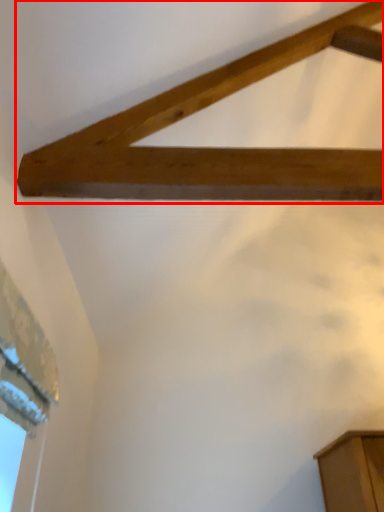
Question: Observing the image, what is the correct spatial positioning of plank (annotated by the red box) in reference to window?

Choices:
 (A) left
 (B) right

Answer: (B)